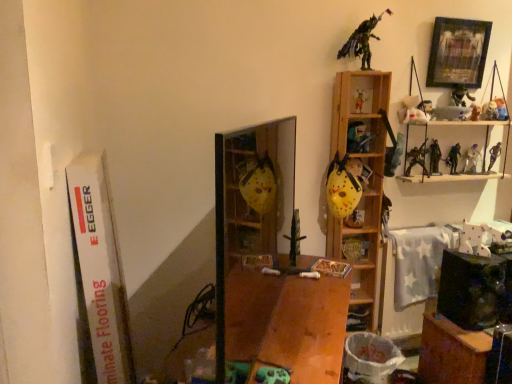
Question: Does transparent plastic cabinet at center, the third cabinet positioned from the right, have a lesser height compared to wooden shelf at upper right?

Choices:
 (A) no
 (B) yes

Answer: (B)

Question: From the image's perspective, is transparent plastic cabinet at center, the 1th cabinet in the left-to-right sequence, over wooden shelf at upper right?

Choices:
 (A) no
 (B) yes

Answer: (B)

Question: Is transparent plastic cabinet at center, the 1th cabinet in the left-to-right sequence, thinner than wooden shelf at upper right?

Choices:
 (A) yes
 (B) no

Answer: (A)

Question: Considering the relative positions of transparent plastic cabinet at center, acting as the third cabinet starting from the back, and wooden shelf at upper right in the image provided, is transparent plastic cabinet at center, acting as the third cabinet starting from the back, to the left of wooden shelf at upper right from the viewer's perspective?

Choices:
 (A) no
 (B) yes

Answer: (B)

Question: Is transparent plastic cabinet at center, which is counted as the 1th cabinet, starting from the front, not within wooden shelf at upper right?

Choices:
 (A) no
 (B) yes

Answer: (B)

Question: Is transparent plastic cabinet at center, which is counted as the 1th cabinet, starting from the front, directly adjacent to wooden shelf at upper right?

Choices:
 (A) yes
 (B) no

Answer: (B)

Question: Considering the relative sizes of wooden book at center and white matte plush toy at upper right, the eighth toy viewed from the left, in the image provided, is wooden book at center shorter than white matte plush toy at upper right, the eighth toy viewed from the left,?

Choices:
 (A) no
 (B) yes

Answer: (B)

Question: From the image's perspective, is wooden book at center under white matte plush toy at upper right, which appears as the 8th toy when viewed from the right?

Choices:
 (A) yes
 (B) no

Answer: (A)

Question: Does wooden book at center lie behind white matte plush toy at upper right, the eighth toy viewed from the left?

Choices:
 (A) no
 (B) yes

Answer: (A)

Question: Is white matte plush toy at upper right, the eighth toy viewed from the left, at the back of wooden book at center?

Choices:
 (A) yes
 (B) no

Answer: (B)

Question: Is wooden book at center wider than white matte plush toy at upper right, which appears as the 8th toy when viewed from the right?

Choices:
 (A) yes
 (B) no

Answer: (A)

Question: Is wooden book at center positioned far away from white matte plush toy at upper right, which appears as the 8th toy when viewed from the right?

Choices:
 (A) yes
 (B) no

Answer: (B)

Question: From the image's perspective, does metallic sword at center, acting as the first toy starting from the left, appear lower than plush teddy bear at upper right, arranged as the first toy when viewed from the right?

Choices:
 (A) no
 (B) yes

Answer: (B)